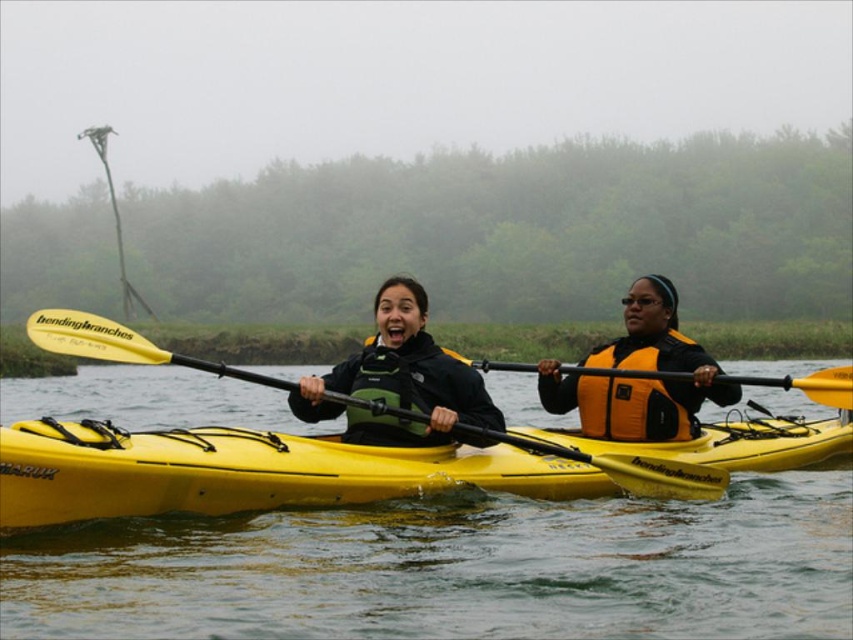
Is matte green life vest at center above yellow matte paddle at center?

Indeed, matte green life vest at center is positioned over yellow matte paddle at center.

Describe the element at coordinates (401, 380) in the screenshot. I see `matte green life vest at center` at that location.

Identify the location of matte green life vest at center. (401, 380).

Where is `matte green life vest at center`? matte green life vest at center is located at coordinates (401, 380).

Consider the image. Does matte green life vest at center have a lesser width compared to orange/yellow fabric life jacket at right?

In fact, matte green life vest at center might be wider than orange/yellow fabric life jacket at right.

Is point (379, 314) closer to camera compared to point (643, 365)?

Yes, point (379, 314) is in front of point (643, 365).

I want to click on matte green life vest at center, so click(401, 380).

Where is `matte green life vest at center`? The width and height of the screenshot is (853, 640). matte green life vest at center is located at coordinates (401, 380).

What do you see at coordinates (401, 380) in the screenshot?
I see `matte green life vest at center` at bounding box center [401, 380].

Find the location of a particular element. matte green life vest at center is located at coordinates (401, 380).

Does point (399, 314) come closer to viewer compared to point (598, 352)?

Yes, it is.

Find the location of a particular element. The height and width of the screenshot is (640, 853). matte green life vest at center is located at coordinates (401, 380).